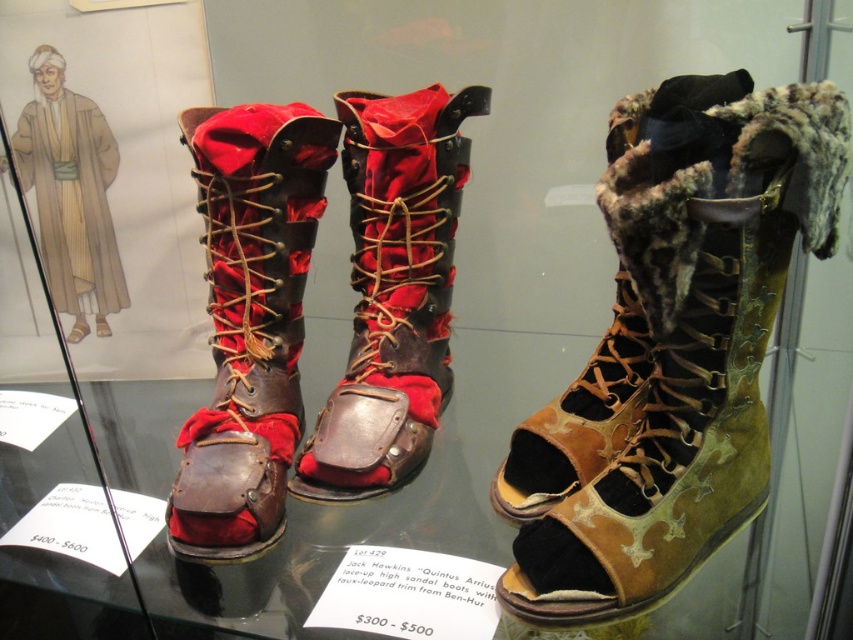
Question: Observing the image, what is the correct spatial positioning of brown leather boot at center in reference to leather/red fabric boots at center?

Choices:
 (A) left
 (B) right

Answer: (A)

Question: Which object is farther from the camera taking this photo?

Choices:
 (A) leather/red fabric boots at center
 (B) brown leather boot at center
 (C) leather with fur trim sandal at right

Answer: (A)

Question: Does brown leather boot at center appear on the right side of leather/red fabric boots at center?

Choices:
 (A) no
 (B) yes

Answer: (A)

Question: Which object is positioned closest to the leather/red fabric boots at center?

Choices:
 (A) brown leather boot at center
 (B) leather with fur trim sandal at right

Answer: (A)

Question: Which point is farther to the camera?

Choices:
 (A) (347, 429)
 (B) (228, 124)
 (C) (596, 360)

Answer: (C)

Question: Can you confirm if leather/red fabric boots at center is thinner than leather with fur trim sandal at right?

Choices:
 (A) no
 (B) yes

Answer: (A)